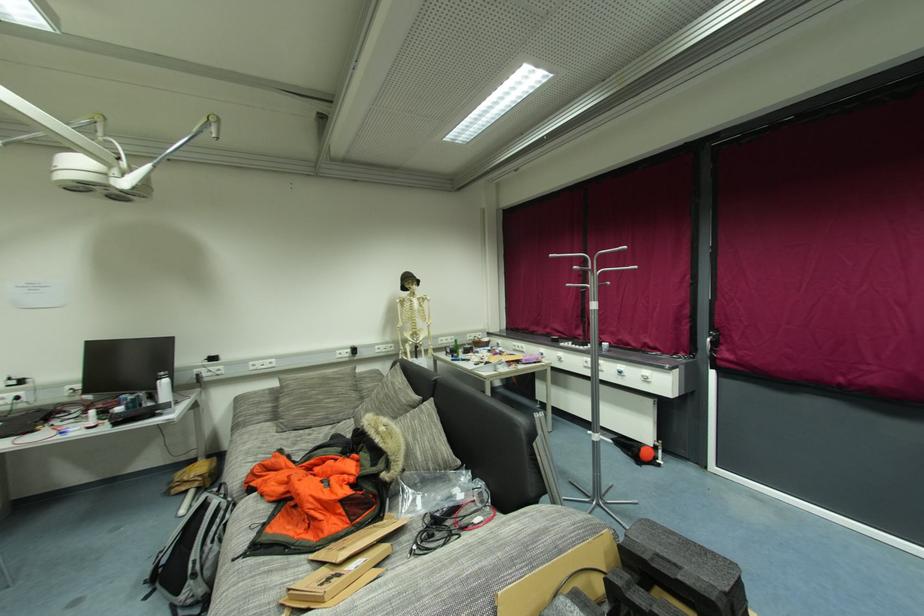
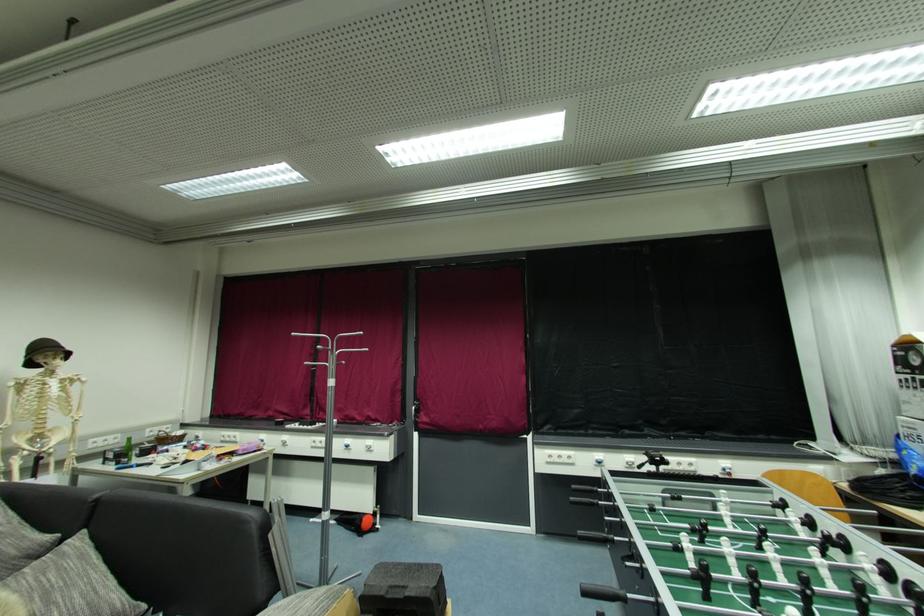
Question: The images are taken continuously from a first-person perspective. In which direction is your viewpoint rotating?

Choices:
 (A) Left
 (B) Right
 (C) Up
 (D) Down

Answer: (B)